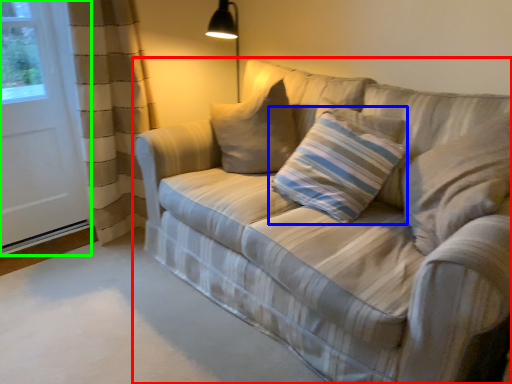
Question: Based on their relative distances, which object is nearer to studio couch (highlighted by a red box)? Choose from pillow (highlighted by a blue box) and screen door (highlighted by a green box).

Choices:
 (A) pillow
 (B) screen door

Answer: (A)